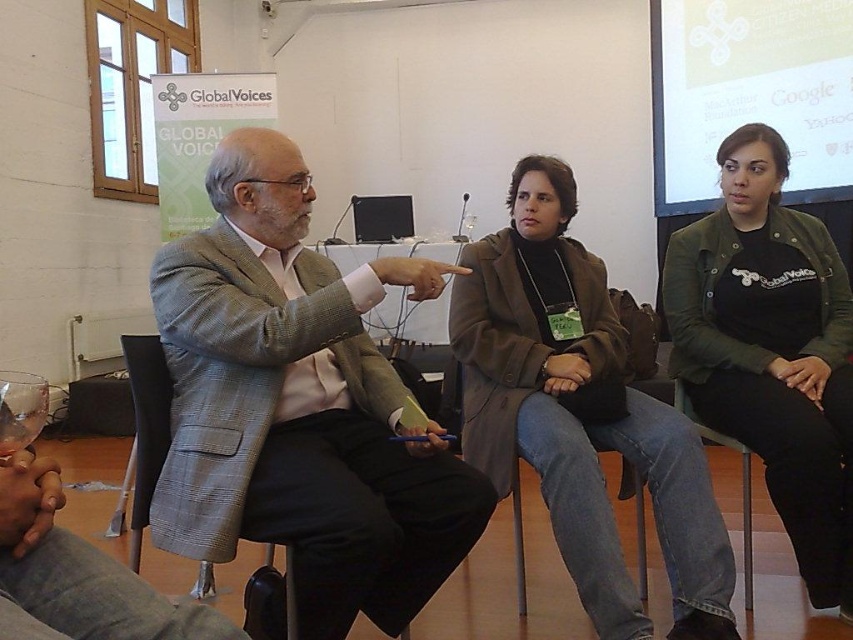
Describe the element at coordinates (579, 412) in the screenshot. I see `brown textured coat at center` at that location.

Can you confirm if brown textured coat at center is smaller than matte white screen at upper right?

Yes.

Which is in front, point (595, 320) or point (670, 211)?

Positioned in front is point (595, 320).

Find the location of a particular element. The image size is (853, 640). brown textured coat at center is located at coordinates (579, 412).

Locate an element on the screen. The width and height of the screenshot is (853, 640). brown textured coat at center is located at coordinates (579, 412).

Is point (627, 428) less distant than point (664, 257)?

Yes, point (627, 428) is closer to viewer.

Which is in front, point (730, 577) or point (788, 449)?

Point (730, 577) is more forward.

At what (x,y) coordinates should I click in order to perform the action: click on brown textured coat at center. Please return your answer as a coordinate pair (x, y). Looking at the image, I should click on (579, 412).

Who is lower down, brown textured coat at center or gray fabric chair at lower left?

gray fabric chair at lower left

Does brown textured coat at center have a lesser height compared to gray fabric chair at lower left?

No.

Image resolution: width=853 pixels, height=640 pixels. What do you see at coordinates (579, 412) in the screenshot? I see `brown textured coat at center` at bounding box center [579, 412].

Locate an element on the screen. brown textured coat at center is located at coordinates (579, 412).